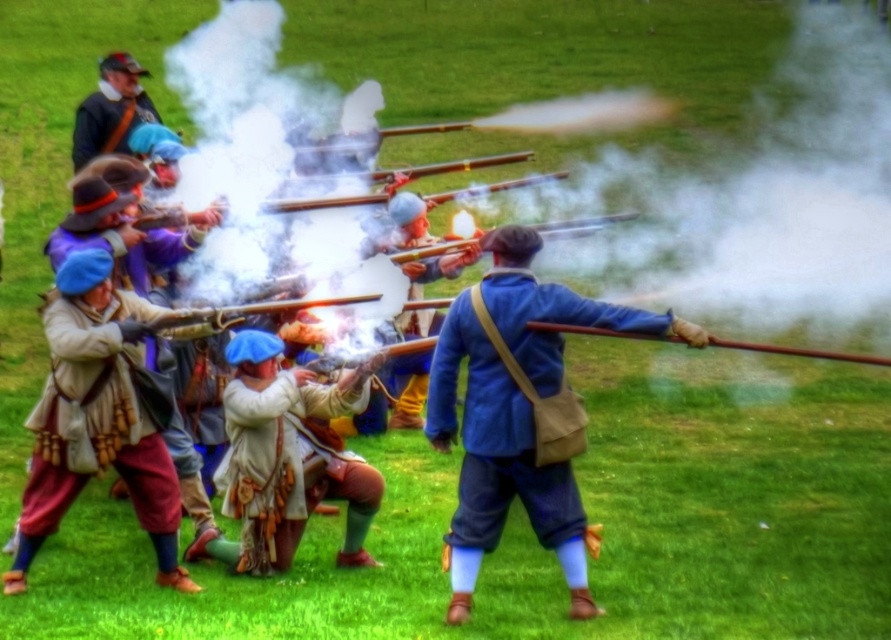
You are a photographer standing at the edge of the field. You want to capture a close shot of the light beige fabric coat at center. Can you estimate how far you need to walk forward to get a clear close shot of the coat?

The light beige fabric coat at center is 11.06 meters away from the camera. To get a clear close shot, you would need to walk forward approximately 11.06 meters towards the coat.

You are a soldier in the reenactment and need to grab your wooden smooth rifle at center quickly. You are currently wearing the blue fabric coat at center. Can you reach your rifle without moving your feet?

The blue fabric coat at center and wooden smooth rifle at center are 1.24 meters apart. Since the distance is greater than an average person can reach without moving, you cannot grab the rifle without moving your feet.

You are a costume designer observing the reenactment scene. You need to determine the vertical positioning of the blue fabric coat at center and white leather boots at center for a historical film. Which object is positioned higher up on the body?

The blue fabric coat at center is much taller as white leather boots at center, meaning the coat is positioned higher up on the body compared to the boots.